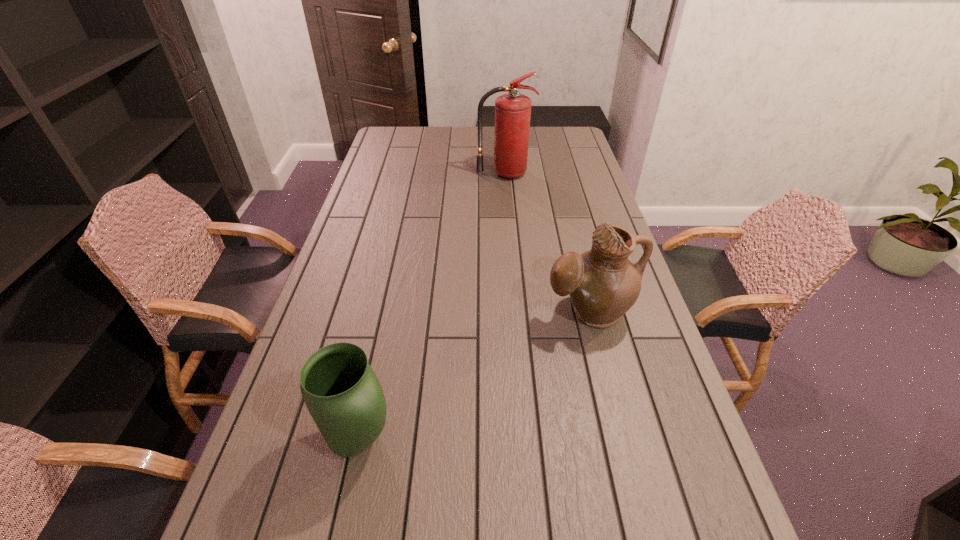
Find the location of a particular element. object that is the closest to the tallest object is located at coordinates (603, 284).